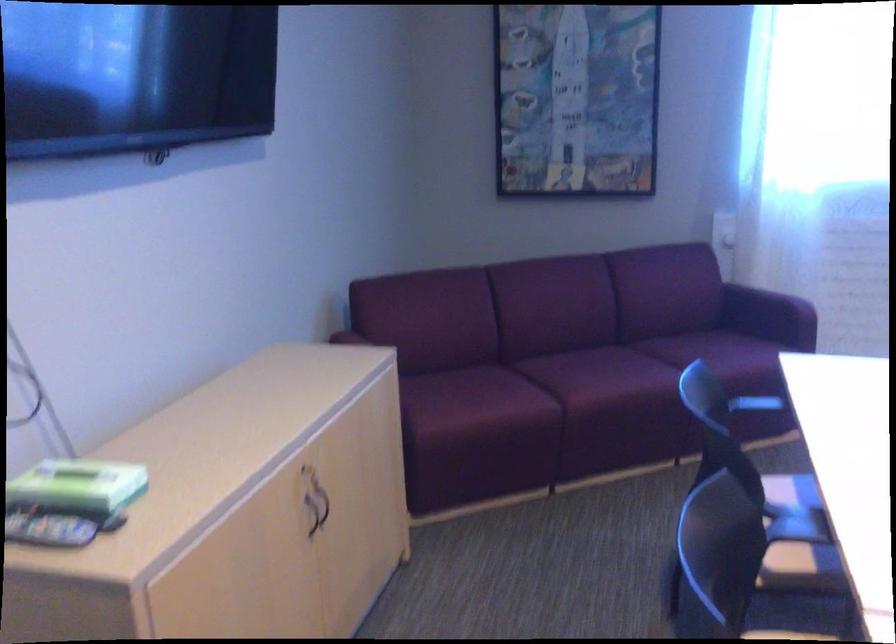
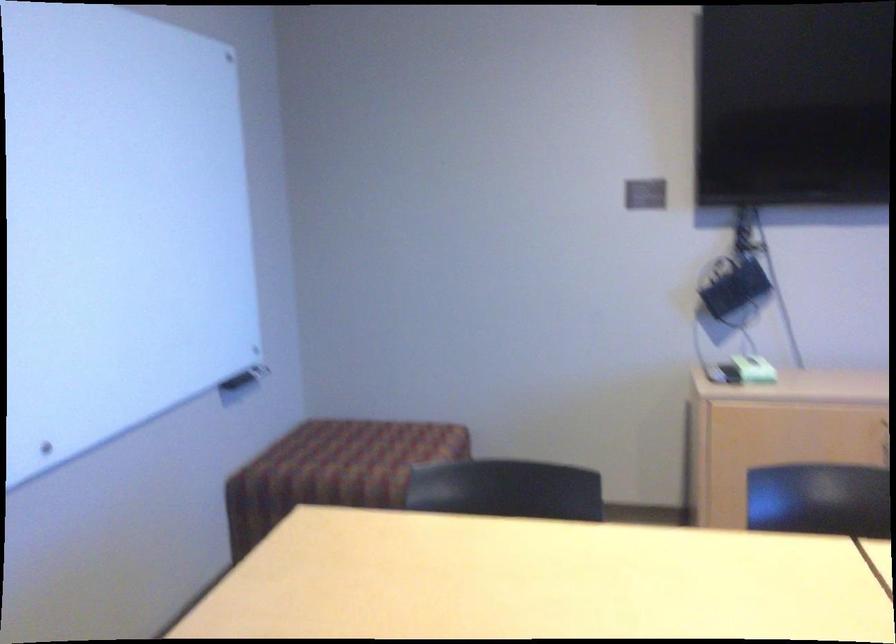
In the second image, find the point that corresponds to (125,486) in the first image.

(754, 368)